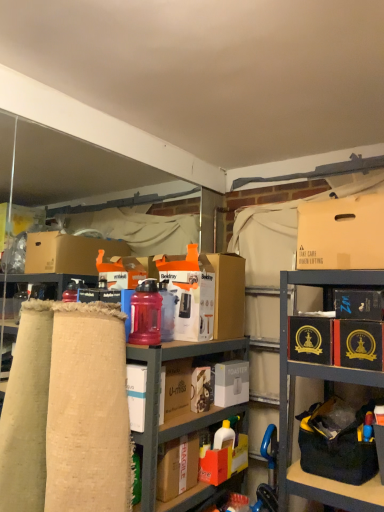
Question: From a real-world perspective, is black cardboard box at upper right, placed as the 3th box when sorted from top to bottom, on top of matte cardboard box at upper right, which is counted as the first box, starting from the top?

Choices:
 (A) yes
 (B) no

Answer: (B)

Question: From the image's perspective, is black cardboard box at upper right, which ranks as the fifth box in bottom-to-top order, above matte cardboard box at upper right, which is counted as the first box, starting from the top?

Choices:
 (A) no
 (B) yes

Answer: (A)

Question: Is there a large distance between black cardboard box at upper right, placed as the 3th box when sorted from top to bottom, and matte cardboard box at upper right, placed as the seventh box when sorted from bottom to top?

Choices:
 (A) no
 (B) yes

Answer: (A)

Question: Would you say black cardboard box at upper right, placed as the 3th box when sorted from top to bottom, is outside matte cardboard box at upper right, placed as the seventh box when sorted from bottom to top?

Choices:
 (A) no
 (B) yes

Answer: (B)

Question: Does black cardboard box at upper right, placed as the 3th box when sorted from top to bottom, have a smaller size compared to matte cardboard box at upper right, placed as the seventh box when sorted from bottom to top?

Choices:
 (A) no
 (B) yes

Answer: (B)

Question: From the image's perspective, is burlap fabric at left positioned above or below black cardboard box at upper right, which ranks as the fifth box in bottom-to-top order?

Choices:
 (A) above
 (B) below

Answer: (B)

Question: Would you say burlap fabric at left is to the left or to the right of black cardboard box at upper right, which ranks as the fifth box in bottom-to-top order, in the picture?

Choices:
 (A) left
 (B) right

Answer: (A)

Question: In the image, is burlap fabric at left positioned in front of or behind black cardboard box at upper right, placed as the 3th box when sorted from top to bottom?

Choices:
 (A) front
 (B) behind

Answer: (A)

Question: Looking at their shapes, would you say burlap fabric at left is wider or thinner than black cardboard box at upper right, placed as the 3th box when sorted from top to bottom?

Choices:
 (A) thin
 (B) wide

Answer: (B)

Question: Considering their positions, is black cardboard box at right, the 4th box positioned from the top, located in front of or behind matte cardboard boxes at center, marked as the 1th cabinetry in a top-to-bottom arrangement?

Choices:
 (A) front
 (B) behind

Answer: (B)

Question: Is black cardboard box at right, the 4th box positioned from the top, situated inside matte cardboard boxes at center, marked as the 1th cabinetry in a top-to-bottom arrangement, or outside?

Choices:
 (A) outside
 (B) inside

Answer: (A)

Question: From the image's perspective, is black cardboard box at right, positioned as the 4th box in bottom-to-top order, located above or below matte cardboard boxes at center, arranged as the 2th cabinetry when ordered from the bottom?

Choices:
 (A) above
 (B) below

Answer: (B)

Question: Is black cardboard box at right, the 4th box positioned from the top, to the left or to the right of matte cardboard boxes at center, arranged as the 2th cabinetry when ordered from the bottom, in the image?

Choices:
 (A) left
 (B) right

Answer: (B)

Question: Is black cardboard box at upper right, which ranks as the fifth box in bottom-to-top order, situated inside white cardboard box at center, which ranks as the second box in top-to-bottom order, or outside?

Choices:
 (A) outside
 (B) inside

Answer: (A)

Question: Considering the positions of black cardboard box at upper right, which ranks as the fifth box in bottom-to-top order, and white cardboard box at center, positioned as the 6th box in bottom-to-top order, in the image, is black cardboard box at upper right, which ranks as the fifth box in bottom-to-top order, taller or shorter than white cardboard box at center, positioned as the 6th box in bottom-to-top order,?

Choices:
 (A) tall
 (B) short

Answer: (B)